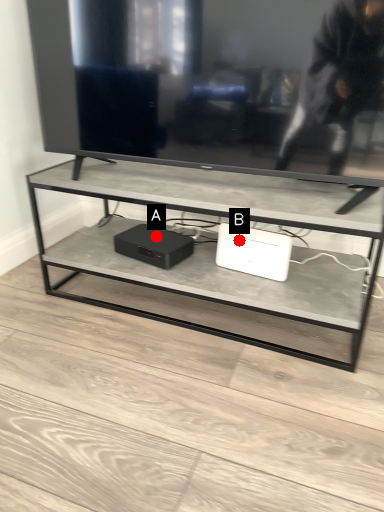
Question: Two points are circled on the image, labeled by A and B beside each circle. Which point is closer to the camera taking this photo?

Choices:
 (A) A is closer
 (B) B is closer

Answer: (B)